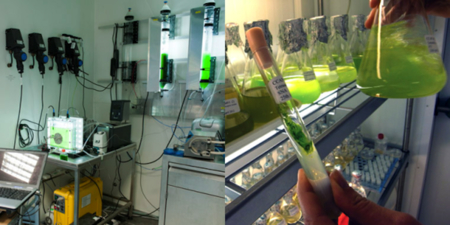
Locate an element on the screen. The image size is (450, 225). cabinet drawers is located at coordinates (196, 182), (199, 209).